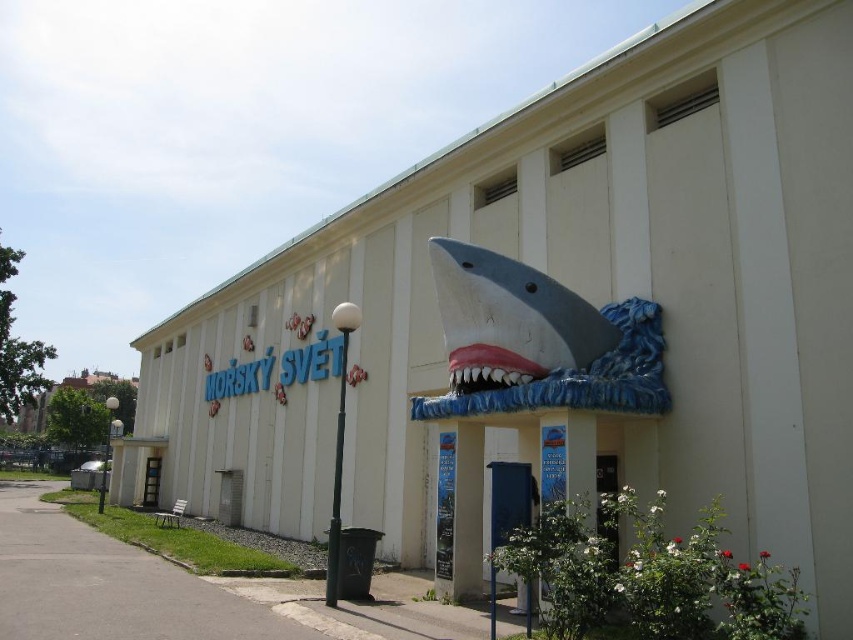
Who is higher up, white matte shark at center or pink glossy jaw at center?

white matte shark at center is above.

Is white matte shark at center taller than pink glossy jaw at center?

Yes.

The image size is (853, 640). Identify the location of white matte shark at center. (509, 320).

Find the location of `white matte shark at center`. white matte shark at center is located at coordinates (509, 320).